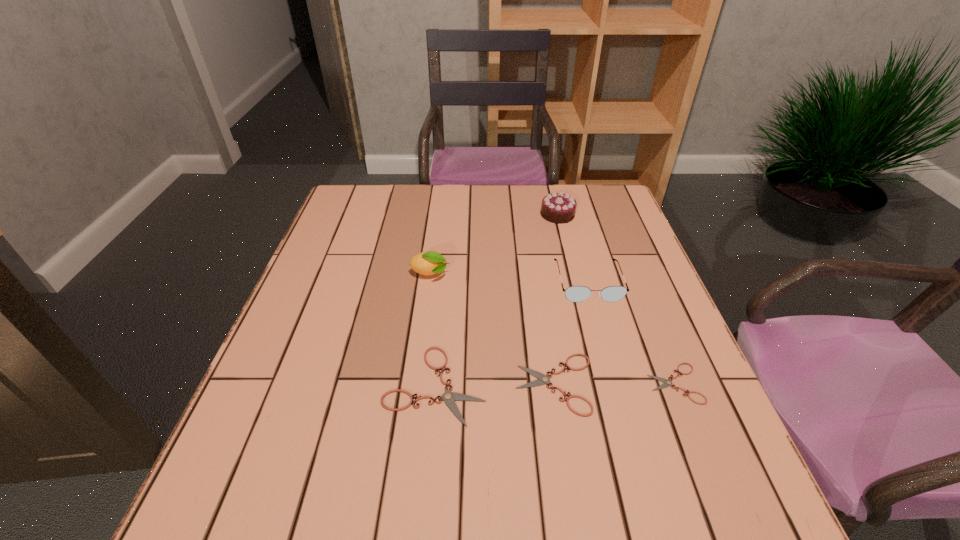
You are a GUI agent. You are given a task and a screenshot of the screen. Output one action in this format:
    pyautogui.click(x=<x>, y=<y>)
    Task: Click on the shears that can be found as the second closest to the spectacles
    This screenshot has width=960, height=540.
    Given the screenshot: What is the action you would take?
    [x=667, y=383]

Where is `vacant region that satisfies the following two spatial constraints: 1. with leaves positioned above the second tallest shears; 2. on the right side of the lemon`? vacant region that satisfies the following two spatial constraints: 1. with leaves positioned above the second tallest shears; 2. on the right side of the lemon is located at coordinates (416, 384).

Find the location of a particular element. This screenshot has height=540, width=960. vacant space that satisfies the following two spatial constraints: 1. with leaves positioned above the leftmost shears; 2. on the right side of the lemon is located at coordinates (416, 384).

You are a GUI agent. You are given a task and a screenshot of the screen. Output one action in this format:
    pyautogui.click(x=<x>, y=<y>)
    Task: Click on the vacant point that satisfies the following two spatial constraints: 1. with leaves positioned above the lemon; 2. on the back side of the leftmost shears
    The height and width of the screenshot is (540, 960).
    Given the screenshot: What is the action you would take?
    pyautogui.click(x=416, y=384)

Locate an element on the screen. free space that satisfies the following two spatial constraints: 1. with leaves positioned above the lemon; 2. on the right side of the leftmost shears is located at coordinates (416, 384).

This screenshot has height=540, width=960. I want to click on vacant area in the image that satisfies the following two spatial constraints: 1. with leaves positioned above the lemon; 2. on the right side of the rightmost shears, so click(416, 383).